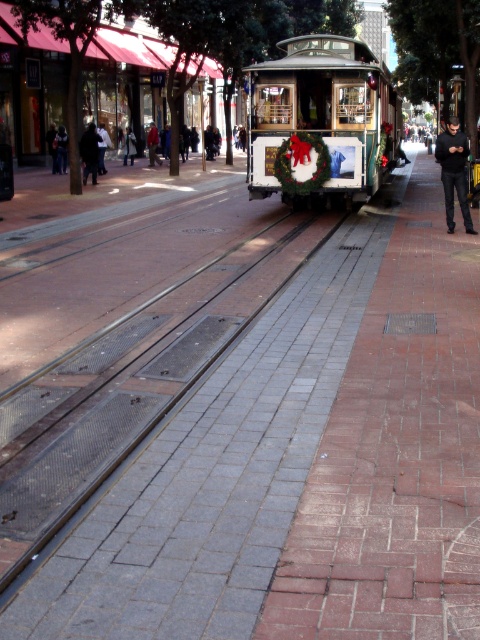
Between point (388, 134) and point (56, 147), which one is positioned in front?

Point (388, 134) is more forward.

Who is positioned more to the left, white wooden cable car at center or dark blue jeans at center?

dark blue jeans at center

Between point (267, 161) and point (57, 161), which one is positioned in front?

Positioned in front is point (267, 161).

Where is `white wooden cable car at center`? This screenshot has height=640, width=480. white wooden cable car at center is located at coordinates (320, 120).

The height and width of the screenshot is (640, 480). Identify the location of white wooden cable car at center. (320, 120).

Is point (394, 138) positioned after point (470, 220)?

Yes, point (394, 138) is farther from viewer.

The height and width of the screenshot is (640, 480). What are the coordinates of `white wooden cable car at center` in the screenshot? It's located at (320, 120).

Find the location of a particular element. The width and height of the screenshot is (480, 640). white wooden cable car at center is located at coordinates (320, 120).

Can you confirm if black fabric jacket at center is smaller than light brown leather jacket at center?

Actually, black fabric jacket at center might be larger than light brown leather jacket at center.

Which is below, black fabric jacket at center or light brown leather jacket at center?

black fabric jacket at center

I want to click on black fabric jacket at center, so click(x=90, y=152).